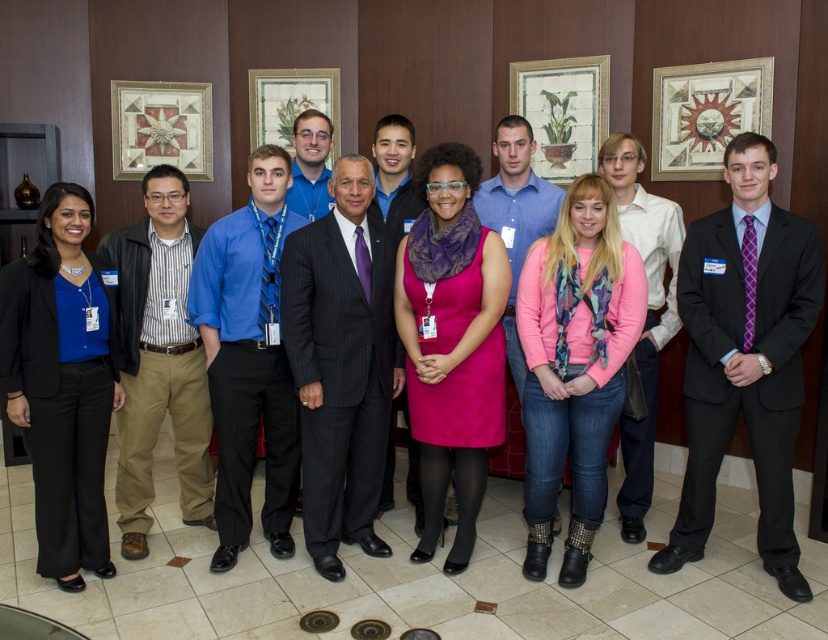
Question: Which point appears closest to the camera in this image?

Choices:
 (A) (277, 428)
 (B) (390, 218)
 (C) (686, 140)
 (D) (532, 232)

Answer: (A)

Question: Is blue shirt at center further to camera compared to matte wooden picture frame at center?

Choices:
 (A) no
 (B) yes

Answer: (A)

Question: Is brown leather pants at left closer to camera compared to blue shirt at center?

Choices:
 (A) no
 (B) yes

Answer: (B)

Question: Which of the following is the farthest from the observer?

Choices:
 (A) click(374, 154)
 (B) click(190, 253)
 (C) click(520, 170)

Answer: (A)

Question: Which point appears closest to the camera in this image?

Choices:
 (A) (152, 140)
 (B) (345, 468)
 (C) (338, 136)
 (D) (417, 310)

Answer: (D)

Question: Is pink soft fabric sweater at center positioned before pink suede dress at center?

Choices:
 (A) yes
 (B) no

Answer: (A)